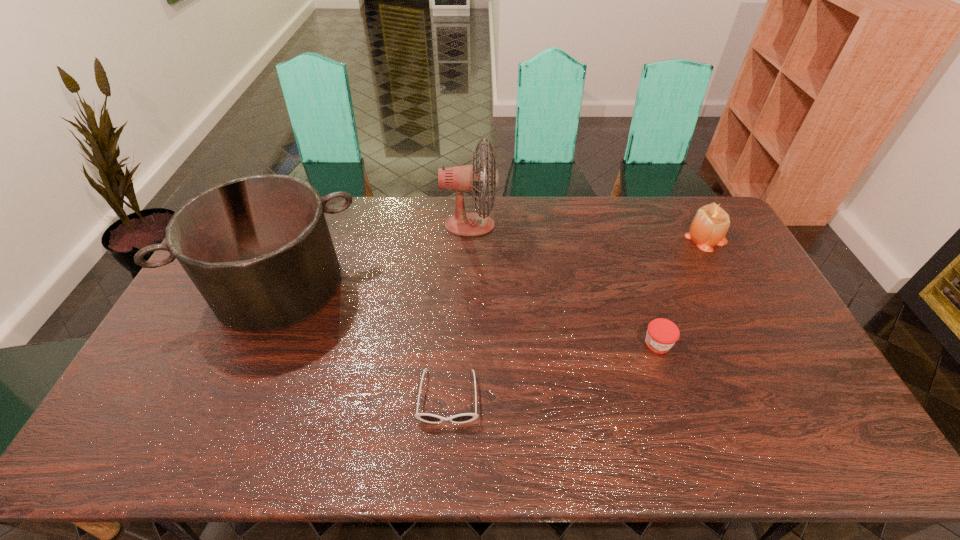
The width and height of the screenshot is (960, 540). Find the location of `free space that is in between the fan and the fourth object from left to right`. free space that is in between the fan and the fourth object from left to right is located at coordinates (564, 285).

Where is `free spot between the third tallest object and the fourth object from left to right`? The image size is (960, 540). free spot between the third tallest object and the fourth object from left to right is located at coordinates (682, 291).

In order to click on vacant space that is in between the sunglasses and the fourth shortest object in this screenshot , I will do `click(364, 341)`.

At what (x,y) coordinates should I click in order to perform the action: click on vacant point located between the second object from right to left and the nearest object. Please return your answer as a coordinate pair (x, y). Image resolution: width=960 pixels, height=540 pixels. Looking at the image, I should click on (553, 370).

Image resolution: width=960 pixels, height=540 pixels. In order to click on free area in between the second tallest object and the rightmost object in this screenshot , I will do `click(492, 261)`.

The image size is (960, 540). Find the location of `object that can be found as the closest to the candle`. object that can be found as the closest to the candle is located at coordinates (662, 334).

Identify which object is the fourth closest to the leftmost object. Please provide its 2D coordinates. Your answer should be formatted as a tuple, i.e. [(x, y)], where the tuple contains the x and y coordinates of a point satisfying the conditions above.

[(711, 222)]

Identify the location of free location that satisfies the following two spatial constraints: 1. in front of the fan to direct airflow; 2. on the right side of the rightmost object. (469, 237).

Locate an element on the screen. vacant space that satisfies the following two spatial constraints: 1. in front of the fan to direct airflow; 2. with the lenses of the nearest object facing outward is located at coordinates tap(466, 397).

Identify the location of blank space that satisfies the following two spatial constraints: 1. in front of the fan to direct airflow; 2. on the front side of the fourth shortest object. The width and height of the screenshot is (960, 540). tap(468, 285).